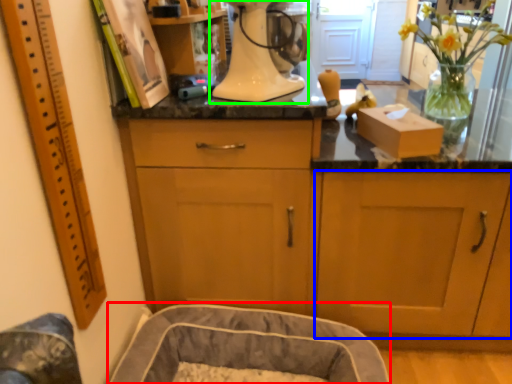
Question: Considering the real-world distances, which object is closest to dog bed (highlighted by a red box)? cabinetry (highlighted by a blue box) or home appliance (highlighted by a green box).

Choices:
 (A) cabinetry
 (B) home appliance

Answer: (A)